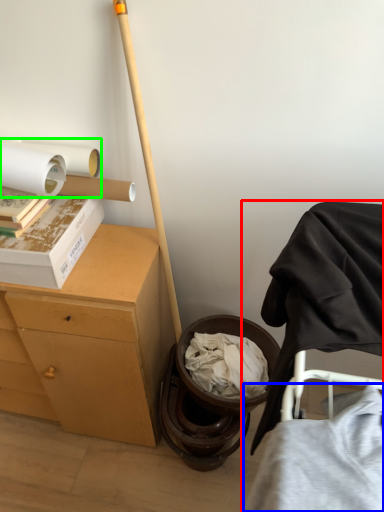
Question: Based on their relative distances, which object is nearer to furniture (highlighted by a red box)? Choose from clothing (highlighted by a blue box) and toilet paper (highlighted by a green box).

Choices:
 (A) clothing
 (B) toilet paper

Answer: (A)